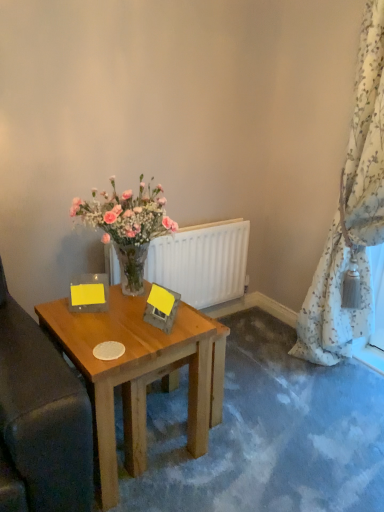
Where is `floral-patterned fabric at right`? The width and height of the screenshot is (384, 512). floral-patterned fabric at right is located at coordinates (351, 214).

What do you see at coordinates (202, 262) in the screenshot?
I see `white matte radiator at center` at bounding box center [202, 262].

Where is `wooden table at center`? wooden table at center is located at coordinates (139, 374).

Where is `radiator below the floral-patterned fabric at right (from the image's perspective)`? This screenshot has height=512, width=384. radiator below the floral-patterned fabric at right (from the image's perspective) is located at coordinates (202, 262).

Is white matte radiator at center far from floral-patterned fabric at right?

white matte radiator at center is near floral-patterned fabric at right, not far away.

Which object is thinner, white matte radiator at center or floral-patterned fabric at right?

Thinner between the two is white matte radiator at center.

Between white matte radiator at center and floral-patterned fabric at right, which one has more height?

floral-patterned fabric at right is taller.

Is floral-patterned fabric at right behind white matte radiator at center?

No, the depth of floral-patterned fabric at right is less than that of white matte radiator at center.

Can you confirm if floral-patterned fabric at right is wider than white matte radiator at center?

Yes.

Is floral-patterned fabric at right facing towards white matte radiator at center?

No, floral-patterned fabric at right is not facing towards white matte radiator at center.

Is point (374, 28) positioned in front of point (158, 274)?

Yes, point (374, 28) is in front of point (158, 274).

I want to click on curtain above the wooden table at center (from the image's perspective), so click(x=351, y=214).

Does wooden table at center have a lesser height compared to floral-patterned fabric at right?

Indeed, wooden table at center has a lesser height compared to floral-patterned fabric at right.

Would you say wooden table at center is a long distance from floral-patterned fabric at right?

Yes.

Could you tell me if wooden table at center is turned towards floral-patterned fabric at right?

No, wooden table at center is not aimed at floral-patterned fabric at right.

Which is more to the left, white matte radiator at center or wooden table at center?

From the viewer's perspective, wooden table at center appears more on the left side.

How much distance is there between white matte radiator at center and wooden table at center?

white matte radiator at center and wooden table at center are 23.60 inches apart.

From the image's perspective, who appears lower, white matte radiator at center or wooden table at center?

wooden table at center, from the image's perspective.

Identify the location of desk on the left of white matte radiator at center. (139, 374).

From the image's perspective, which is below, wooden table at center or white matte radiator at center?

wooden table at center is shown below in the image.

Looking at the image, does wooden table at center seem bigger or smaller compared to white matte radiator at center?

wooden table at center is bigger than white matte radiator at center.

Is floral-patterned fabric at right turned away from wooden table at center?

No.

Looking at this image, would you say wooden table at center is part of floral-patterned fabric at right's contents?

No, wooden table at center is not inside floral-patterned fabric at right.

In the image, is floral-patterned fabric at right positioned in front of or behind wooden table at center?

Clearly, floral-patterned fabric at right is behind wooden table at center.

Which is more to the right, floral-patterned fabric at right or wooden table at center?

From the viewer's perspective, floral-patterned fabric at right appears more on the right side.

Locate an element on the screen. The image size is (384, 512). curtain located above the white matte radiator at center (from a real-world perspective) is located at coordinates (351, 214).

Where is `radiator below the floral-patterned fabric at right (from the image's perspective)`? radiator below the floral-patterned fabric at right (from the image's perspective) is located at coordinates (202, 262).

Estimate the real-world distances between objects in this image. Which object is further from wooden table at center, white matte radiator at center or floral-patterned fabric at right?

floral-patterned fabric at right is positioned further to the anchor wooden table at center.

Estimate the real-world distances between objects in this image. Which object is further from floral-patterned fabric at right, white matte radiator at center or wooden table at center?

wooden table at center is further to floral-patterned fabric at right.

Looking at the image, which one is located closer to wooden table at center, floral-patterned fabric at right or white matte radiator at center?

white matte radiator at center is closer to wooden table at center.

Considering their positions, is floral-patterned fabric at right positioned closer to white matte radiator at center than wooden table at center?

Based on the image, wooden table at center appears to be nearer to white matte radiator at center.

When comparing their distances from floral-patterned fabric at right, does wooden table at center or white matte radiator at center seem further?

Among the two, wooden table at center is located further to floral-patterned fabric at right.

From the image, which object appears to be nearer to white matte radiator at center, wooden table at center or floral-patterned fabric at right?

wooden table at center lies closer to white matte radiator at center than the other object.

Find the location of a particular element. Image resolution: width=384 pixels, height=512 pixels. radiator between wooden table at center and floral-patterned fabric at right in the horizontal direction is located at coordinates (202, 262).